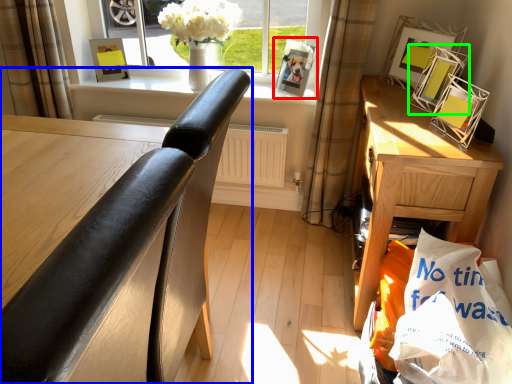
Question: Based on their relative distances, which object is nearer to picture frame (highlighted by a red box)? Choose from chair (highlighted by a blue box) and picture frame (highlighted by a green box).

Choices:
 (A) chair
 (B) picture frame

Answer: (B)